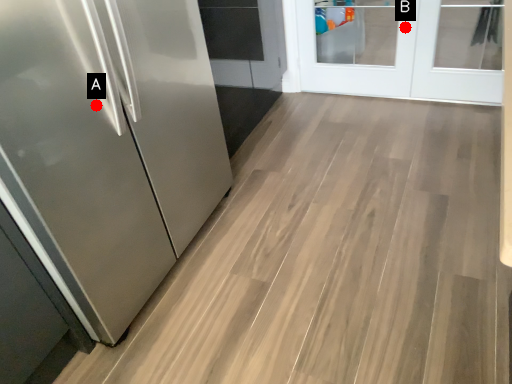
Question: Two points are circled on the image, labeled by A and B beside each circle. Which point is closer to the camera?

Choices:
 (A) A is closer
 (B) B is closer

Answer: (A)